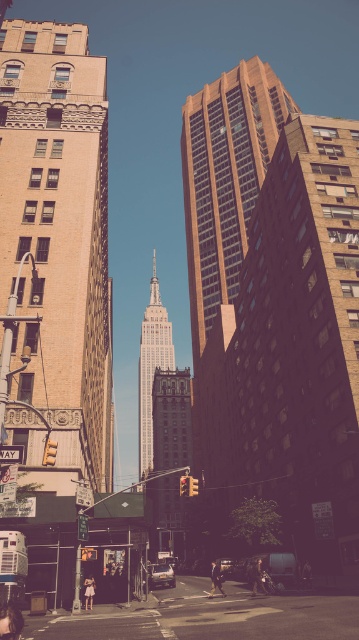
You are standing on the street looking up at the Empire State Building and other skyscrapers. There are two points marked on your view of the scene. The first point is at coordinates point (x=2, y=243) and the second is at point (x=226, y=568). Which of these points is closer to you?

Point (x=2, y=243) is closer to the viewer than point (x=226, y=568).

You are standing on the street looking up at the Empire State Building and other skyscrapers. You notice two points marked in the image. One is at coordinate point (x=170, y=344) and the other at point (x=260, y=576). From your perspective, which point is closer to you?

Point (x=260, y=576) is closer to you because point (x=170, y=344) is behind it.

From the picture: You are a photographer standing on the street and want to capture both the beige stone building at left and the dark brown leather jacket at center in a single photo. Based on their positions, which object should you focus on first to ensure both are in frame?

The beige stone building at left is above the dark brown leather jacket at center, so you should focus on the dark brown leather jacket at center first to ensure both are in frame.